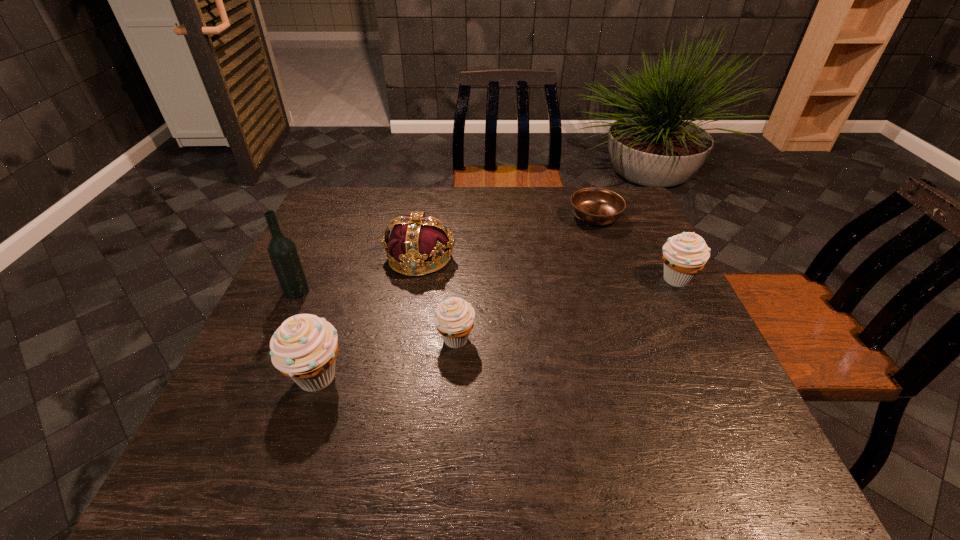
Where is `the leftmost muffin`? This screenshot has height=540, width=960. the leftmost muffin is located at coordinates (304, 348).

Where is `the second muffin from right to left`? the second muffin from right to left is located at coordinates click(454, 318).

This screenshot has height=540, width=960. In order to click on the shortest muffin in this screenshot , I will do `click(454, 318)`.

This screenshot has width=960, height=540. What are the coordinates of `the rightmost object` in the screenshot? It's located at (684, 255).

You are a GUI agent. You are given a task and a screenshot of the screen. Output one action in this format:
    pyautogui.click(x=<x>, y=<y>)
    Task: Click on the rightmost muffin
    The width and height of the screenshot is (960, 540).
    Given the screenshot: What is the action you would take?
    pyautogui.click(x=684, y=255)

Find the location of `the second object from right to left`. the second object from right to left is located at coordinates (596, 206).

Locate an element on the screen. soup bowl is located at coordinates (596, 206).

Identify the location of crown. point(415,239).

This screenshot has width=960, height=540. Identify the location of vodka. (282, 251).

Locate an element on the screen. The image size is (960, 540). the leftmost object is located at coordinates (282, 251).